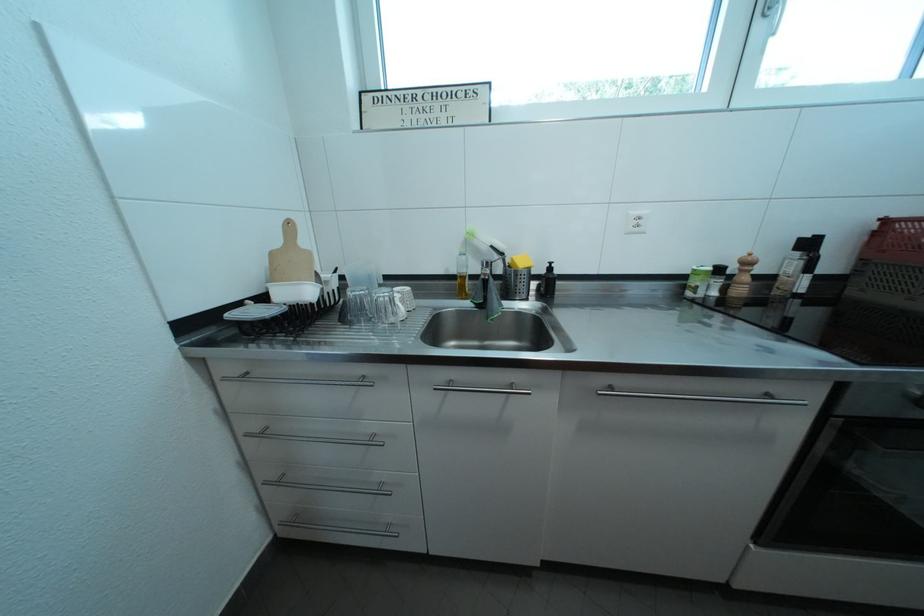
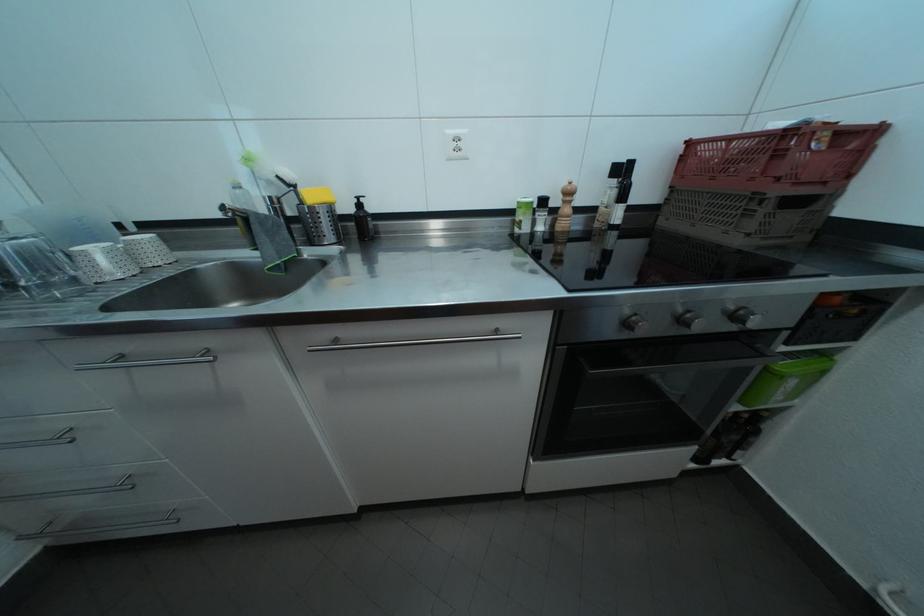
Question: Based on the continuous images, in which direction is the camera rotating? Reply with the corresponding letter.

Choices:
 (A) Left
 (B) Right
 (C) Up
 (D) Down

Answer: (D)